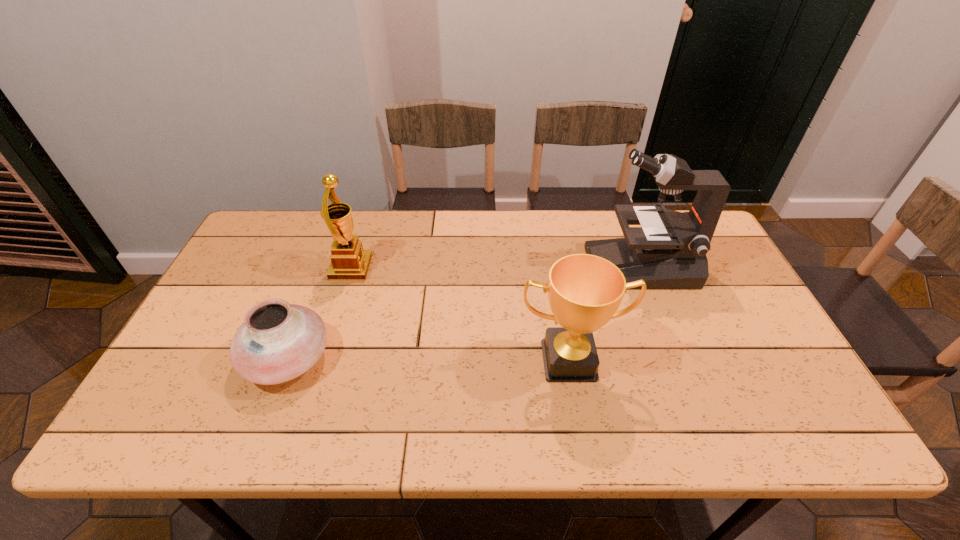
Where is `microscope located at the far edge`? microscope located at the far edge is located at coordinates click(x=668, y=251).

I want to click on award that is positioned at the far edge, so click(349, 261).

Image resolution: width=960 pixels, height=540 pixels. I want to click on object present at the right edge, so click(668, 251).

Locate an element on the screen. object present at the far right corner is located at coordinates (668, 251).

In order to click on free space at the far edge in this screenshot , I will do `click(395, 227)`.

The height and width of the screenshot is (540, 960). Identify the location of free spot at the near edge of the desktop. (527, 423).

The image size is (960, 540). In order to click on blank space at the left edge of the desktop in this screenshot , I will do `click(268, 292)`.

Find the location of `vacant space at the near left corner`. vacant space at the near left corner is located at coordinates (x=209, y=411).

Where is `vacant area at the far right corner`? Image resolution: width=960 pixels, height=540 pixels. vacant area at the far right corner is located at coordinates (707, 254).

Locate an element on the screen. vacant space that's between the left award and the shortest object is located at coordinates (320, 313).